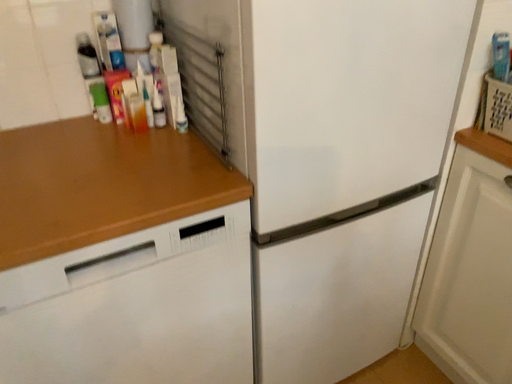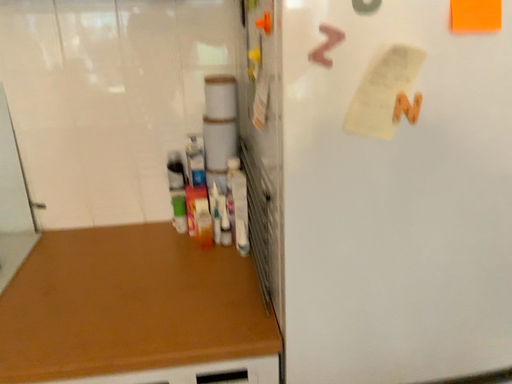
Question: Which way did the camera rotate in the video?

Choices:
 (A) rotated downward
 (B) rotated upward

Answer: (B)